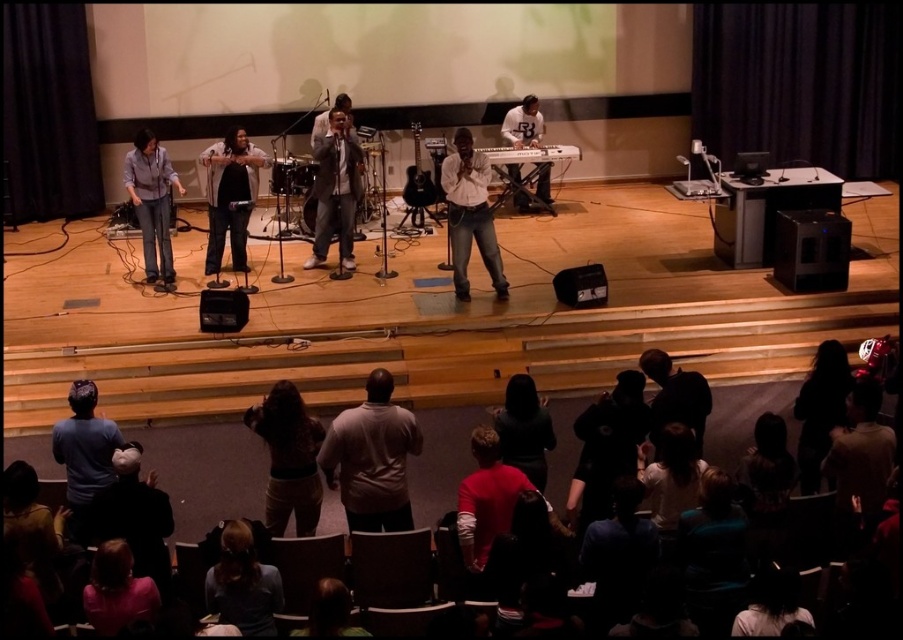
Question: Which is farther from the dark gray sweater at lower left?

Choices:
 (A) silhouette hair at lower right
 (B) pink fabric shirt at lower left
 (C) black fabric at center

Answer: (A)

Question: Considering the real-world distances, which object is farthest from the silhouette hair at lower right?

Choices:
 (A) dark gray sweater at lower left
 (B) matte black shirt at center
 (C) matte black microphones at center

Answer: (B)

Question: Is curly hair at center thinner than pink fabric shirt at lower left?

Choices:
 (A) no
 (B) yes

Answer: (A)

Question: Is matte black microphones at center to the left of white shirt at center from the viewer's perspective?

Choices:
 (A) yes
 (B) no

Answer: (B)

Question: Based on their relative distances, which object is farther from the dark gray sweater at lower left?

Choices:
 (A) dark brown hair at lower right
 (B) silhouette hair at lower right
 (C) shiny silver microphone at center
 (D) gray matte shirt at center

Answer: (C)

Question: Is pink fabric shirt at lower left above black fabric at center?

Choices:
 (A) yes
 (B) no

Answer: (B)